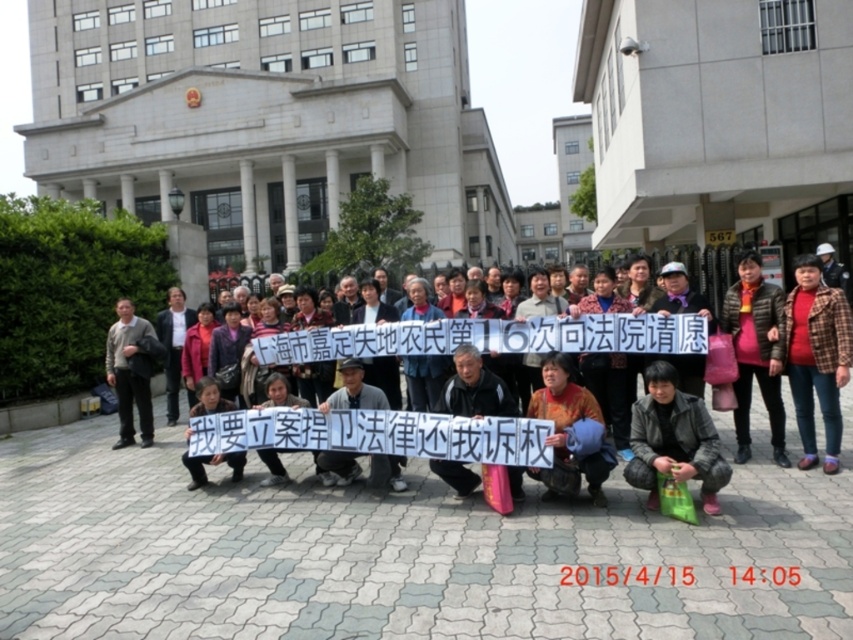
Question: Which object appears closest to the camera in this image?

Choices:
 (A) dark gray leather jacket at lower right
 (B) red plaid shirt at center
 (C) gray sweater at left
 (D) matte black sign at center

Answer: (A)

Question: Can you confirm if dark gray leather jacket at lower right is thinner than gray sweater at left?

Choices:
 (A) no
 (B) yes

Answer: (A)

Question: Does matte black sign at center appear under dark gray leather jacket at lower right?

Choices:
 (A) no
 (B) yes

Answer: (A)

Question: Does matte black sign at center have a larger size compared to dark gray leather jacket at lower right?

Choices:
 (A) yes
 (B) no

Answer: (A)

Question: Which is nearer to the matte black sign at center?

Choices:
 (A) gray sweater at left
 (B) dark gray leather jacket at lower right
 (C) red plaid shirt at center

Answer: (B)

Question: Considering the real-world distances, which object is farthest from the dark gray leather jacket at lower right?

Choices:
 (A) red plaid shirt at center
 (B) matte black sign at center

Answer: (A)